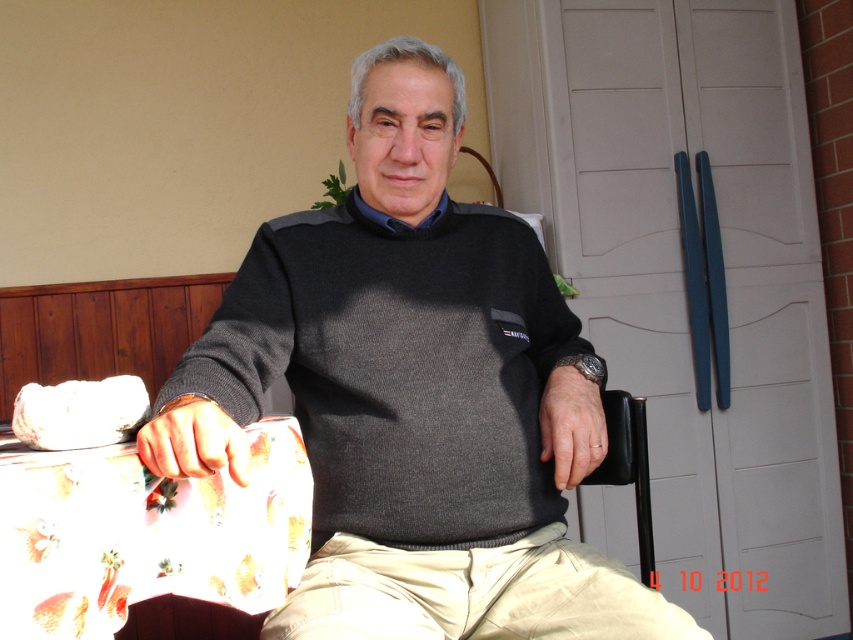
You are an interior designer planning to place a new rug in the living room. The rug must be positioned so that it does not cover the khaki cotton pants at lower center. Based on the scene description, where should you place the rug to ensure it stays clear of the khaki pants?

The khaki cotton pants at lower center is located at point (473, 595). To avoid covering it, the rug should be placed away from this coordinate, ensuring there is no overlap with the area around (473, 595).

You are a delivery person trying to place a large package on the floor between the khaki cotton pants at lower center and the black plastic chair at lower right. Can you fit the package there if it measures 1.2 meters in width?

The khaki cotton pants at lower center might be wider than black plastic chair at lower right, so the space between them may not be sufficient for a package that is 1.2 meters wide. Check the actual distance before placing the package.

You are a tailor measuring fabrics for a project. You see the khaki cotton pants at lower center and the black plastic chair at lower right in the room. Which object would require more fabric to cover its surface?

The khaki cotton pants at lower center is larger in size than the black plastic chair at lower right, so it would require more fabric to cover its surface.